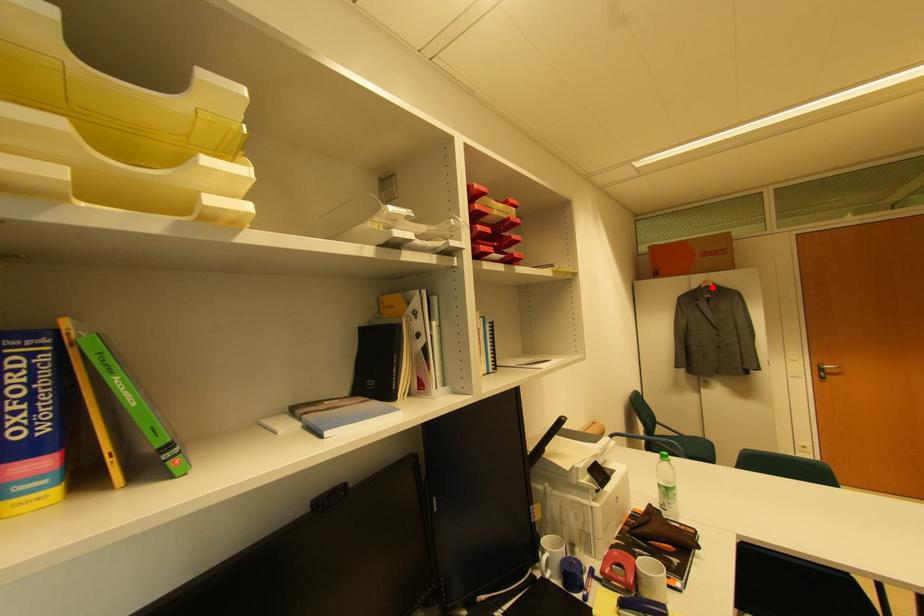
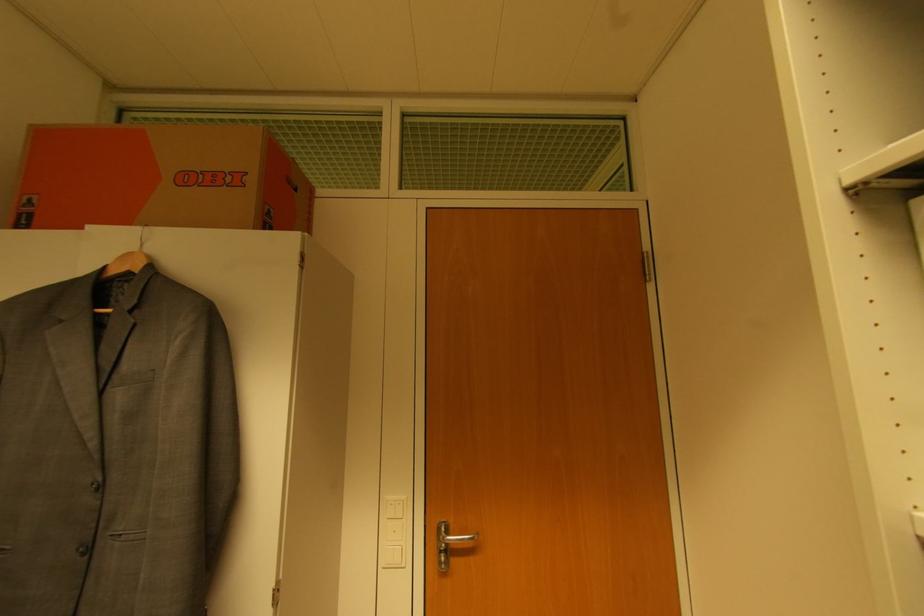
Find the pixel in the second image that matches the highlighted location in the first image.

(137, 270)